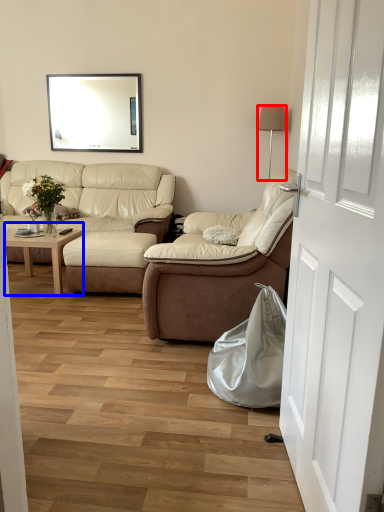
Question: Which object appears farthest to the camera in this image, lamp (highlighted by a red box) or coffee table (highlighted by a blue box)?

Choices:
 (A) lamp
 (B) coffee table

Answer: (A)